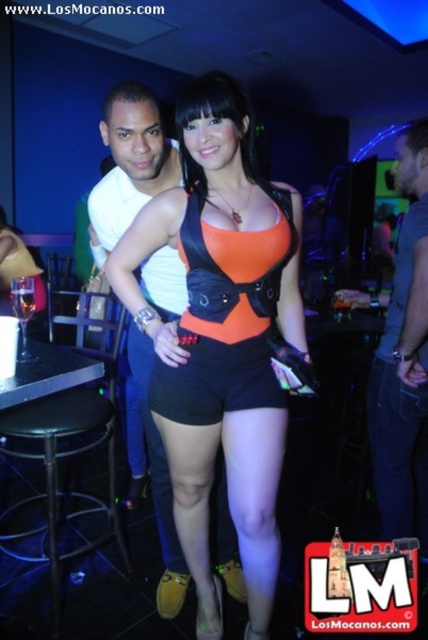
Question: Which object is closer to the camera taking this photo?

Choices:
 (A) clear glass at bar left
 (B) black fabric shorts at center
 (C) orange matte bikini top at center

Answer: (C)

Question: Which object is closer to the camera taking this photo?

Choices:
 (A) clear glass at bar left
 (B) orange matte bikini top at center
 (C) black metal bar stool at lower left

Answer: (B)

Question: Is orange matte tank top at center closer to the viewer compared to orange matte bikini top at center?

Choices:
 (A) yes
 (B) no

Answer: (A)

Question: Does orange matte tank top at center come in front of black metal bar stool at lower left?

Choices:
 (A) no
 (B) yes

Answer: (B)

Question: Is gray cotton shirt at center closer to camera compared to clear glass at bar left?

Choices:
 (A) no
 (B) yes

Answer: (A)

Question: Which point is farther to the camera?

Choices:
 (A) (422, 125)
 (B) (267, 305)
 (C) (18, 308)
 (D) (190, 385)

Answer: (A)